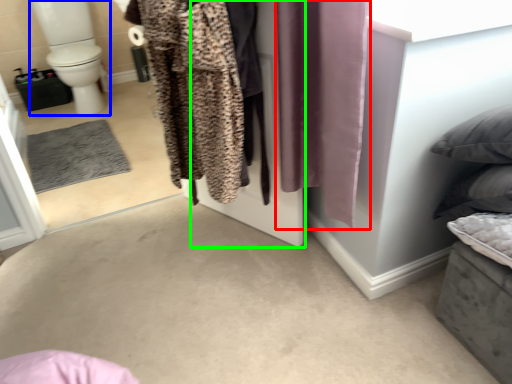
Question: Considering the real-world distances, which object is farthest from curtain (highlighted by a red box)? toilet bowl (highlighted by a blue box) or screen door (highlighted by a green box)?

Choices:
 (A) toilet bowl
 (B) screen door

Answer: (A)